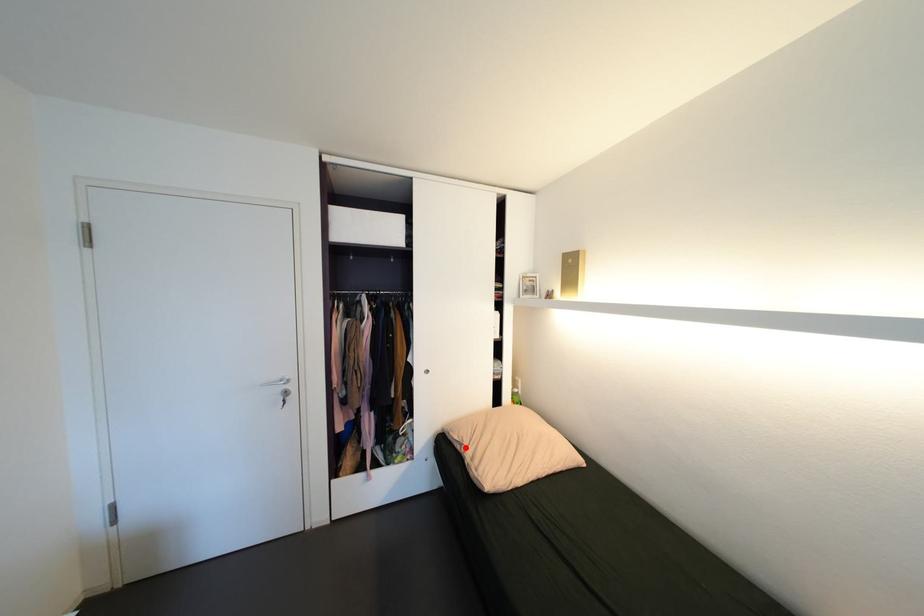
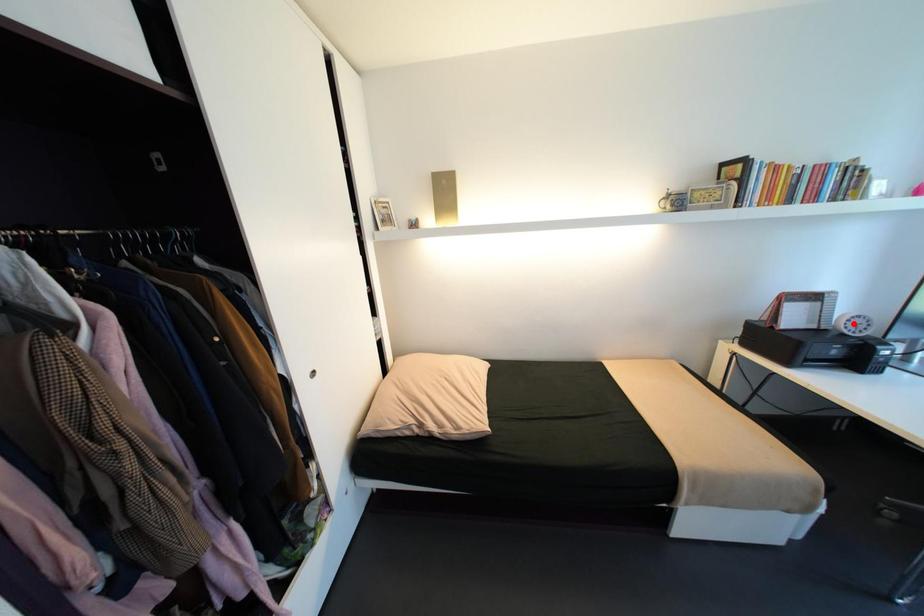
I am providing you with two images of the same scene from different viewpoints. A red point is marked on the first image and another point is marked on the second image. Is the marked point in image1 the same physical position as the marked point in image2?

No